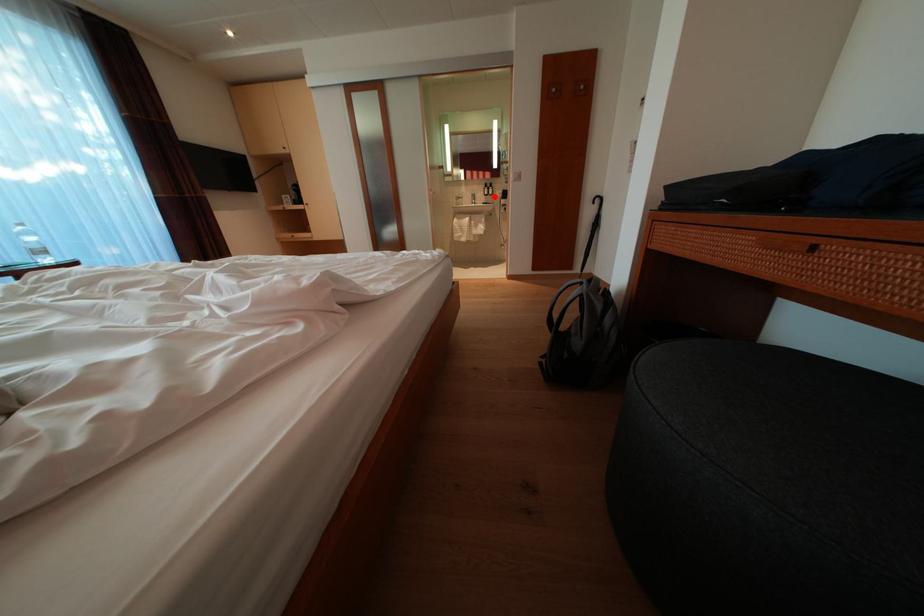
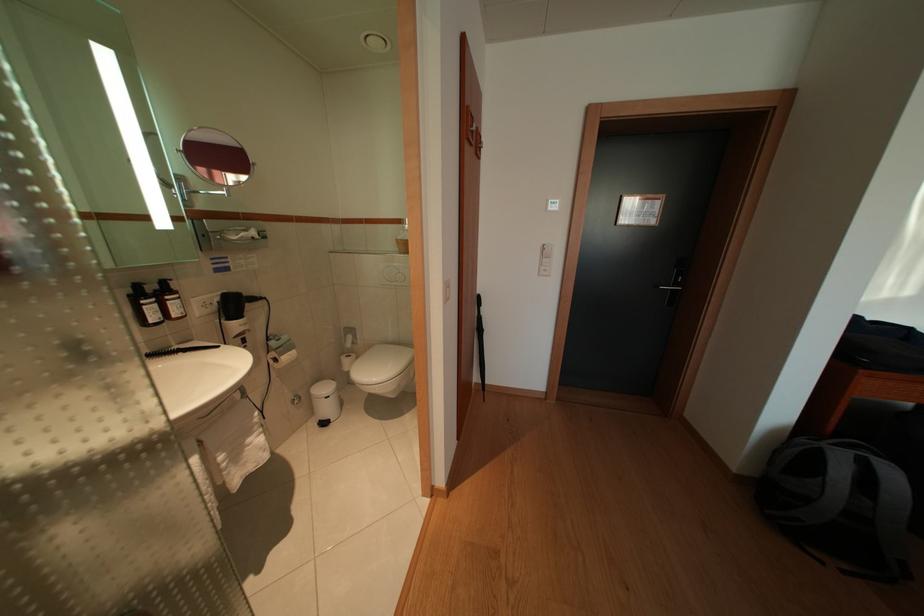
Where in the second image is the point corresponding to the highlighted location from the first image?

(159, 315)